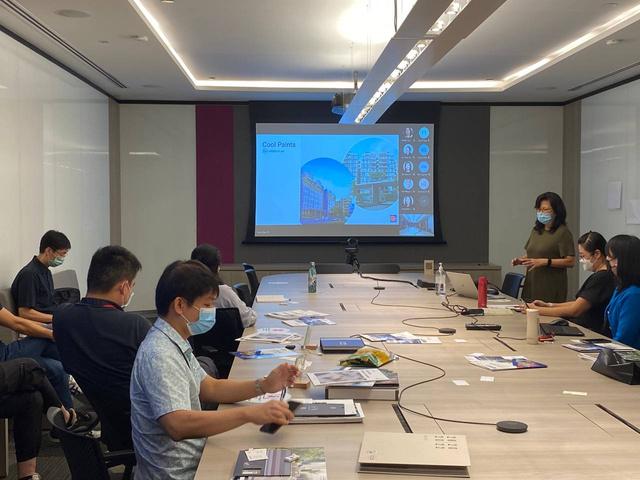
This screenshot has height=480, width=640. Find the location of `white boards lining the walls`. white boards lining the walls is located at coordinates point(132,147), point(67,188), point(531,154), point(602,138).